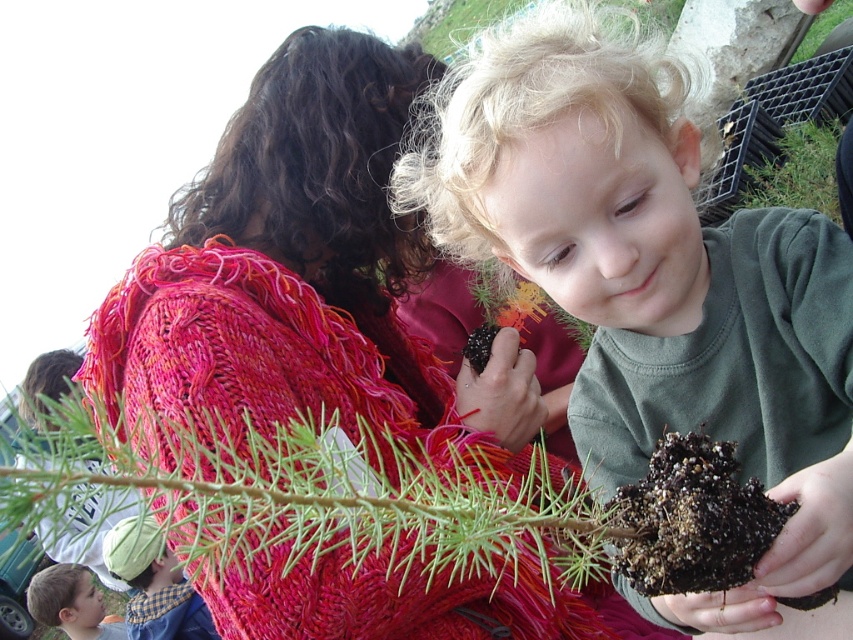
What do you see at coordinates (288, 273) in the screenshot? This screenshot has width=853, height=640. I see `knitted wool scarf at upper center` at bounding box center [288, 273].

This screenshot has height=640, width=853. I want to click on knitted wool scarf at upper center, so click(288, 273).

Identify the location of knitted wool scarf at upper center. (288, 273).

Which of these two, dark green soil at upper right or smooth skin face at lower left, stands taller?

Standing taller between the two is smooth skin face at lower left.

Find the location of a particular element. dark green soil at upper right is located at coordinates (798, 170).

Who is lower down, knitted wool scarf at upper center or brown fuzzy plant at upper center?

knitted wool scarf at upper center is lower down.

Is knitted wool scarf at upper center bigger than brown fuzzy plant at upper center?

Incorrect, knitted wool scarf at upper center is not larger than brown fuzzy plant at upper center.

Identify the location of knitted wool scarf at upper center. The width and height of the screenshot is (853, 640). (288, 273).